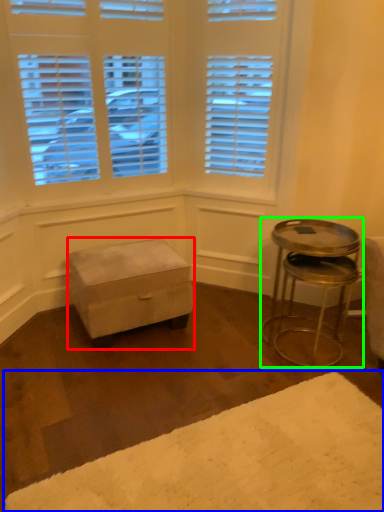
Question: Which is nearer to the stool (highlighted by a red box)? plain (highlighted by a blue box) or table (highlighted by a green box).

Choices:
 (A) plain
 (B) table

Answer: (B)